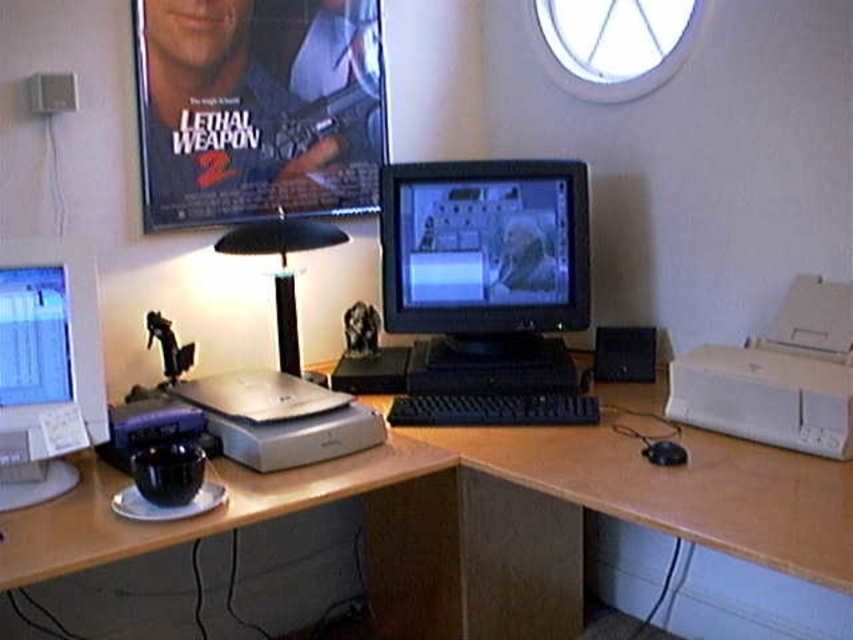
You are organizing a desk and want to place a matte plastic poster at upper left and a sleek silver laptop at center. Which object has a larger width?

The matte plastic poster at upper left might be wider than sleek silver laptop at center.

You are setting up a new keyboard and laptop on your desk. The black plastic keyboard at center and the sleek silver laptop at center need to be placed in a row. Which one should you place first if you want the shorter device to be on the left side?

You should place the black plastic keyboard at center first on the left side since it is shorter than the sleek silver laptop at center.

Consider the image. You are organizing your desk and want to place a new keyboard between the matte plastic poster at upper left and the sleek silver laptop at center. The keyboard is 12 inches long. Do you think it will fit without overlapping either item?

The distance between the matte plastic poster at upper left and the sleek silver laptop at center is 25.79 inches. Since the keyboard is only 12 inches long, there is enough space to place it between them without overlapping either item.